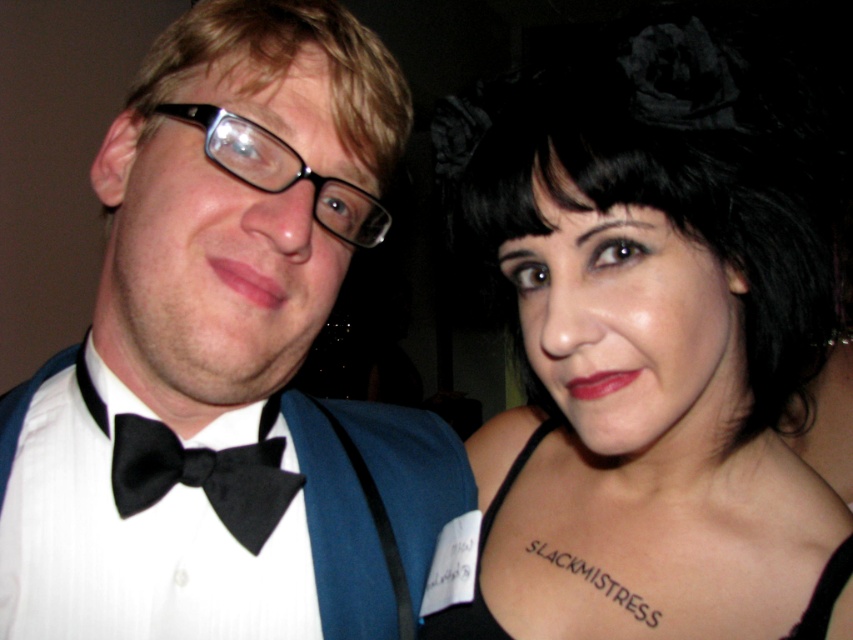
You are a photographer trying to focus on the black satin bow tie at left. You notice a point with coordinates (202, 476) in the image. Is this point located on the black satin bow tie at left?

Yes, the point (202, 476) is on the black satin bow tie at left.

You are a photographer at the event and want to ensure that both the black plastic glasses at left and the black fabric dress at center are clearly visible in the photo. Based on their positions, which object might be partially obscured and why?

The black fabric dress at center might be partially obscured because the black plastic glasses at left is in front of it, potentially blocking part of the dress from view.

You are a photographer adjusting the lighting for a portrait. You notice the white satin bow tie at center and the black plastic glasses at left. Which object is positioned more to the left?

The white satin bow tie at center is positioned more to the left than the black plastic glasses at left.